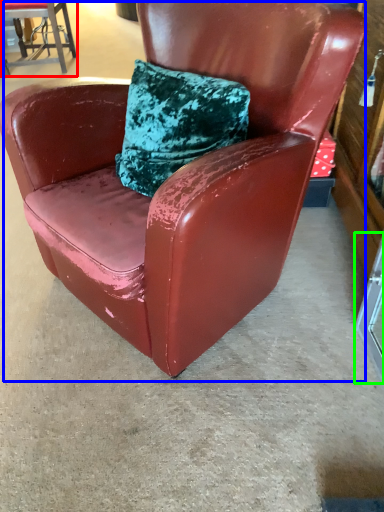
Question: Which object is positioned farthest from chair (highlighted by a red box)? Select from chair (highlighted by a blue box) and glass door (highlighted by a green box).

Choices:
 (A) chair
 (B) glass door

Answer: (B)